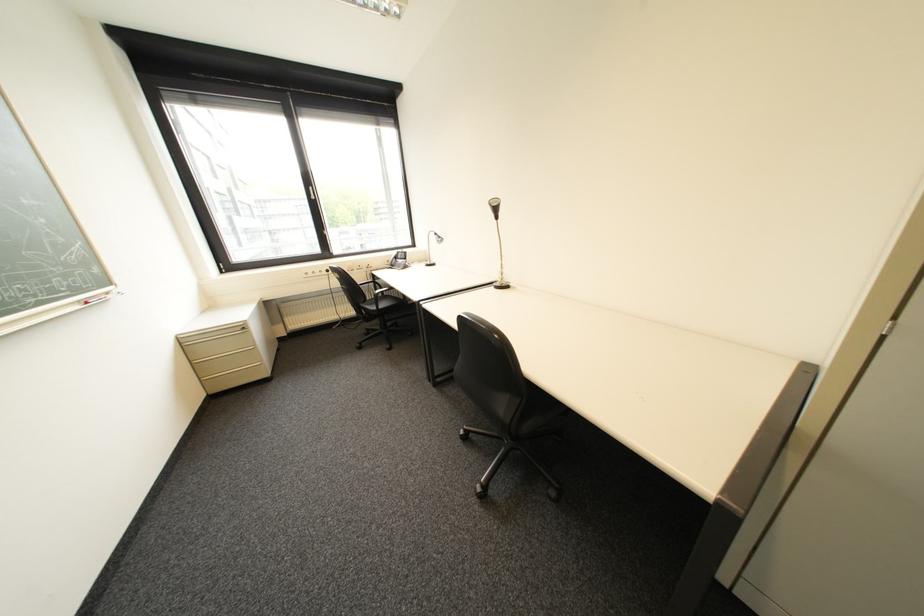
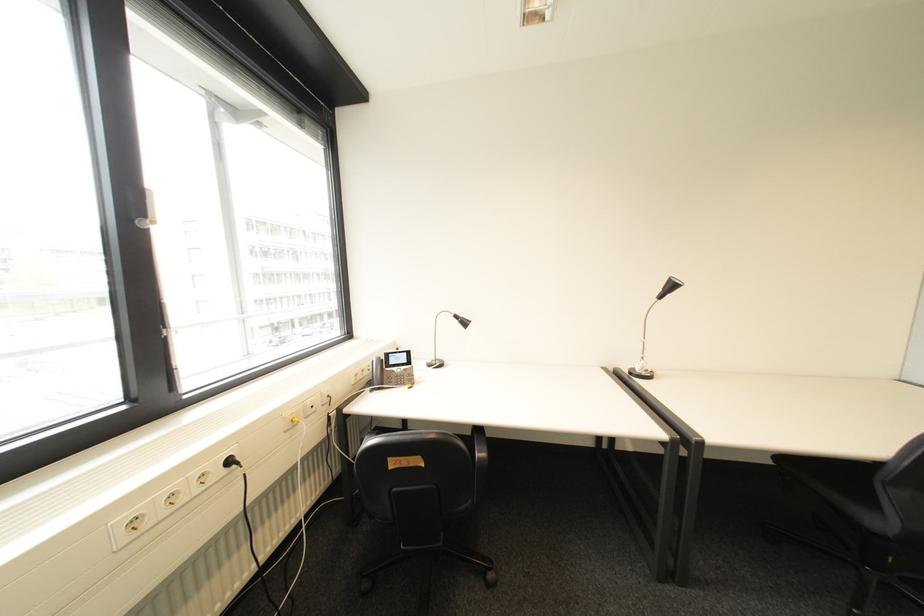
In the second image, find the point that corresponds to (337,272) in the first image.

(239, 463)